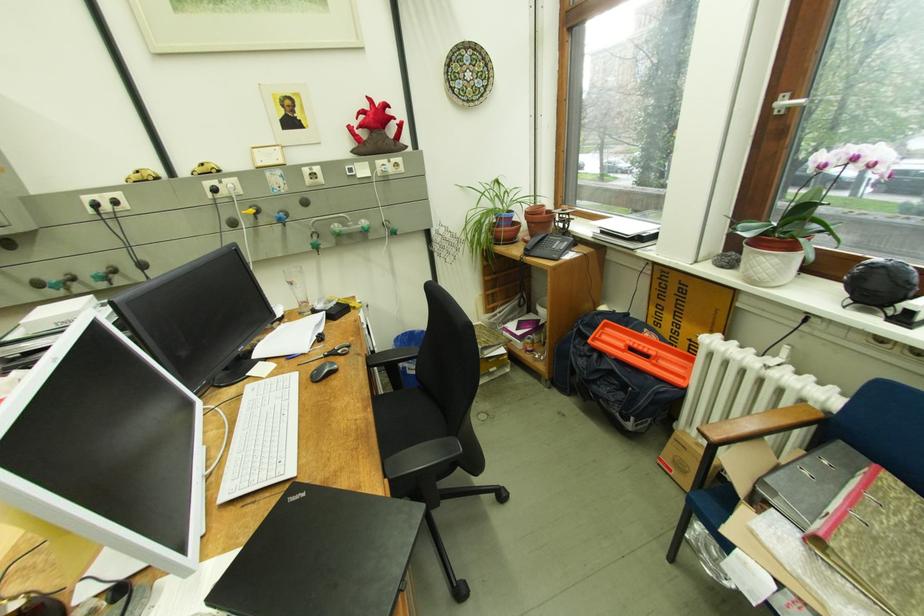
I want to click on wooden chair armrest, so click(x=738, y=448).